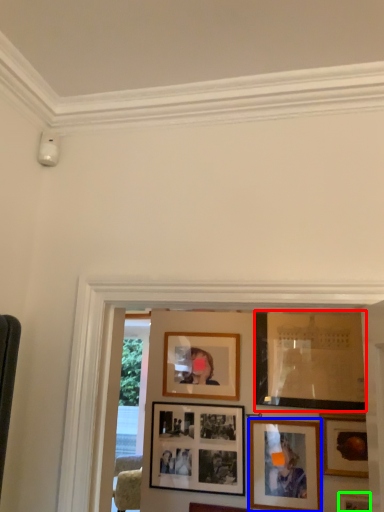
Question: Estimate the real-world distances between objects in this image. Which object is farther from picture frame (highlighted by a red box), picture frame (highlighted by a blue box) or picture frame (highlighted by a green box)?

Choices:
 (A) picture frame
 (B) picture frame

Answer: (B)